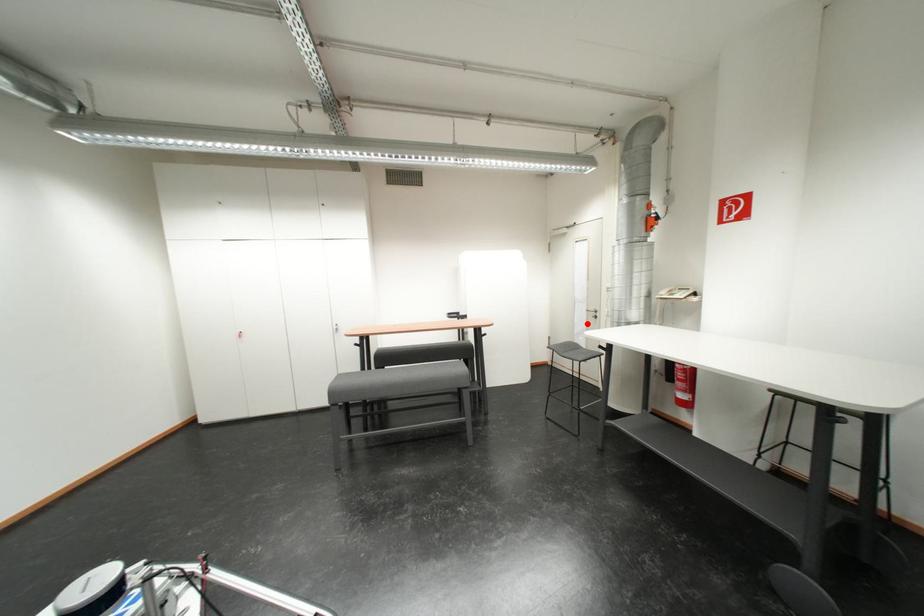
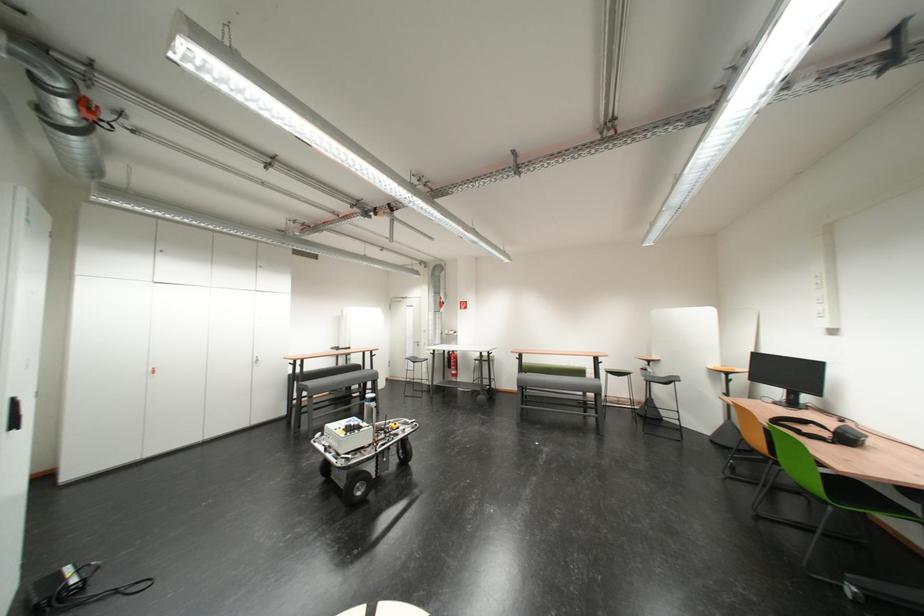
Question: I am providing you with two images of the same scene from different viewpoints. A red point is marked on the first image. Can you still see the location of the red point in image 2?

Choices:
 (A) Yes
 (B) No

Answer: (A)